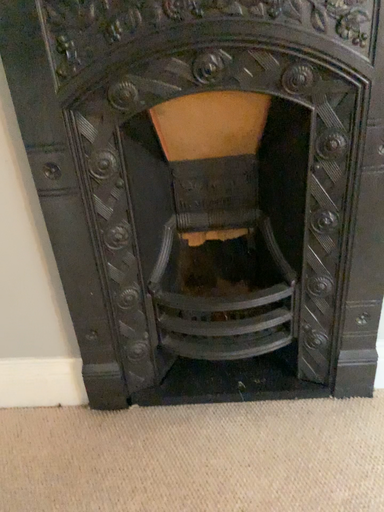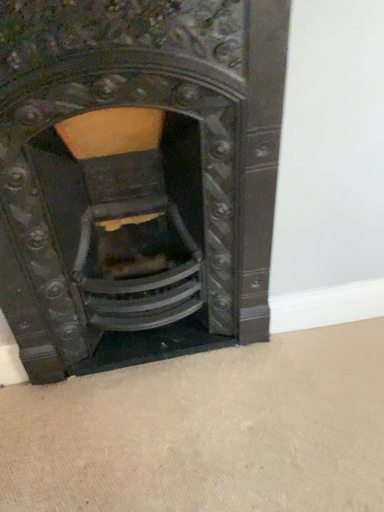
Question: Which way did the camera rotate in the video?

Choices:
 (A) rotated downward
 (B) rotated upward

Answer: (A)